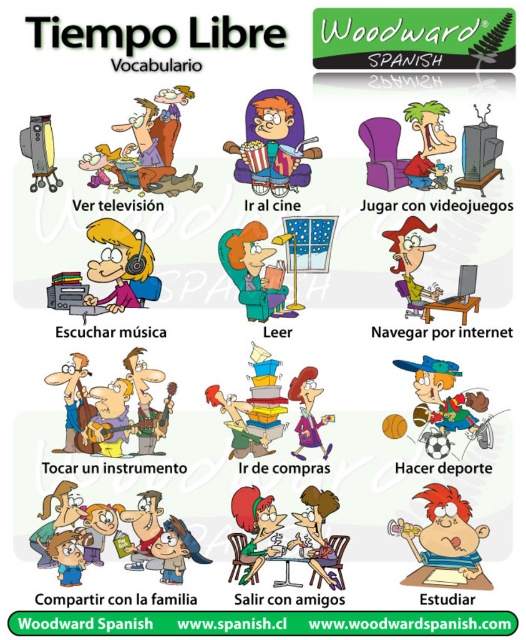
Does reddish-orange hair at lower right appear over matte purple dress at center?

No.

Locate an element on the screen. The height and width of the screenshot is (640, 526). reddish-orange hair at lower right is located at coordinates (444, 541).

This screenshot has width=526, height=640. What do you see at coordinates (444, 541) in the screenshot? I see `reddish-orange hair at lower right` at bounding box center [444, 541].

This screenshot has width=526, height=640. I want to click on reddish-orange hair at lower right, so (x=444, y=541).

Is orange hair at center wider than matte purple dress at center?

Yes.

Between point (301, 148) and point (298, 422), which one is positioned behind?

Positioned behind is point (298, 422).

Between point (263, 188) and point (297, 394), which one is positioned behind?

Point (297, 394)

I want to click on orange hair at center, so click(272, 145).

Which is below, reddish-orange hair at lower right or matte green sweater at center?

reddish-orange hair at lower right is below.

Is reddish-orange hair at lower right below matte green sweater at center?

Yes.

Locate an element on the screen. The width and height of the screenshot is (526, 640). reddish-orange hair at lower right is located at coordinates (444, 541).